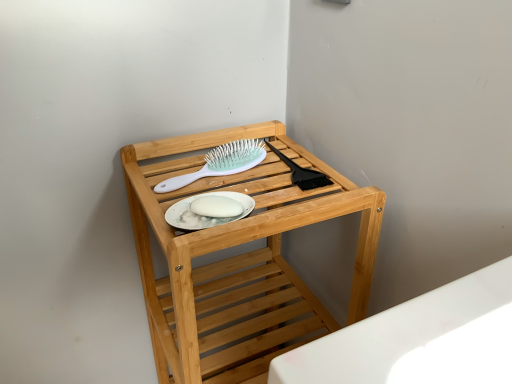
Image resolution: width=512 pixels, height=384 pixels. I want to click on free area in between white plastic hairbrush at upper center and white matte platter at center, so click(215, 196).